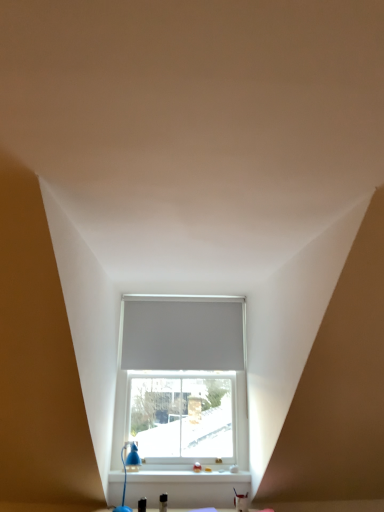
Question: From the image's perspective, does white matte blind at center appear higher than blue plastic table lamp at lower left?

Choices:
 (A) no
 (B) yes

Answer: (B)

Question: Can you see white matte blind at center touching blue plastic table lamp at lower left?

Choices:
 (A) no
 (B) yes

Answer: (A)

Question: Can you confirm if white matte blind at center is positioned to the right of blue plastic table lamp at lower left?

Choices:
 (A) no
 (B) yes

Answer: (B)

Question: Can you confirm if white matte blind at center is bigger than blue plastic table lamp at lower left?

Choices:
 (A) no
 (B) yes

Answer: (B)

Question: Is white matte blind at center at the left side of blue plastic table lamp at lower left?

Choices:
 (A) yes
 (B) no

Answer: (B)

Question: Is white matte blind at center taller than blue plastic table lamp at lower left?

Choices:
 (A) no
 (B) yes

Answer: (B)

Question: Would you say white matte blind at center is outside white matte window at center?

Choices:
 (A) no
 (B) yes

Answer: (A)

Question: Is white matte blind at center directly adjacent to white matte window at center?

Choices:
 (A) yes
 (B) no

Answer: (A)

Question: Is the position of white matte blind at center more distant than that of white matte window at center?

Choices:
 (A) no
 (B) yes

Answer: (B)

Question: From a real-world perspective, does white matte blind at center stand above white matte window at center?

Choices:
 (A) yes
 (B) no

Answer: (A)

Question: Does white matte blind at center have a smaller size compared to white matte window at center?

Choices:
 (A) no
 (B) yes

Answer: (B)

Question: Does white matte blind at center have a greater width compared to white matte window at center?

Choices:
 (A) no
 (B) yes

Answer: (B)

Question: From the image's perspective, does white matte window at center appear higher than white plastic window sill at lower center?

Choices:
 (A) no
 (B) yes

Answer: (B)